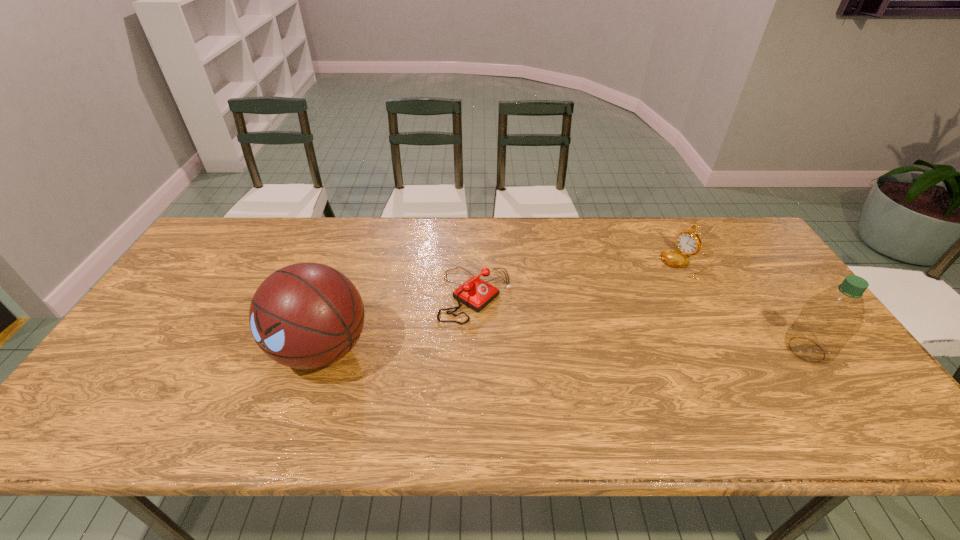
Find the location of a particular element. This screenshot has height=540, width=960. free area in between the leftmost object and the rightmost object is located at coordinates (564, 349).

Where is `free space between the water bottle and the leftmost object`? This screenshot has height=540, width=960. free space between the water bottle and the leftmost object is located at coordinates (564, 349).

Locate an element on the screen. empty space between the second shortest object and the telephone is located at coordinates (581, 279).

The width and height of the screenshot is (960, 540). Find the location of `object that stands as the closest to the second object from left to right`. object that stands as the closest to the second object from left to right is located at coordinates 306,316.

In order to click on object that is the third closest one to the rightmost object in this screenshot , I will do `click(306, 316)`.

In order to click on free space that satisfies the following two spatial constraints: 1. on the back side of the second object from right to left; 2. on the left side of the telephone in this screenshot , I will do `click(476, 263)`.

I want to click on vacant area in the image that satisfies the following two spatial constraints: 1. on the back side of the leftmost object; 2. on the right side of the second object from right to left, so click(x=350, y=263).